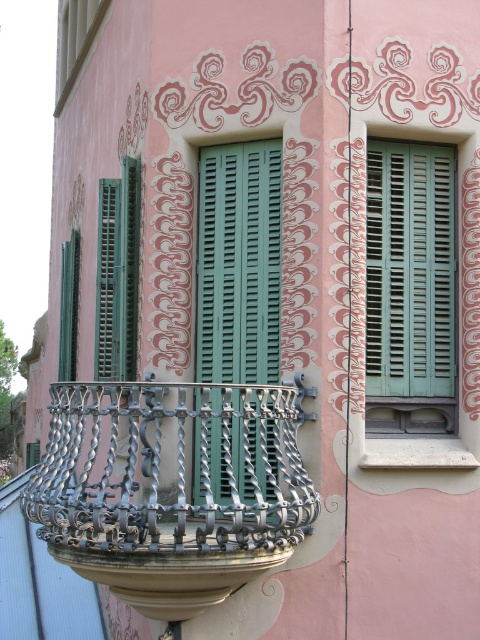
Between point (225, 280) and point (375, 362), which one is positioned behind?

The point (225, 280) is behind.

What do you see at coordinates (239, 262) in the screenshot? I see `green matte shutters at center` at bounding box center [239, 262].

Describe the element at coordinates (239, 262) in the screenshot. I see `green matte shutters at center` at that location.

Locate an element on the screen. The width and height of the screenshot is (480, 640). green matte shutters at center is located at coordinates (239, 262).

Can you confirm if polished metal balcony at center is positioned to the right of green matte shutters at center?

In fact, polished metal balcony at center is to the left of green matte shutters at center.

At what (x,y) coordinates should I click in order to perform the action: click on polished metal balcony at center. Please return your answer as a coordinate pair (x, y). Image resolution: width=480 pixels, height=640 pixels. Looking at the image, I should click on (172, 467).

Identify the location of polished metal balcony at center. This screenshot has width=480, height=640. (172, 467).

Is polished metal balcony at center taller than teal wooden shutters at center?

In fact, polished metal balcony at center may be shorter than teal wooden shutters at center.

Can you confirm if polished metal balcony at center is smaller than teal wooden shutters at center?

Incorrect, polished metal balcony at center is not smaller in size than teal wooden shutters at center.

Does point (273, 412) come behind point (409, 273)?

No, (273, 412) is in front of (409, 273).

At what (x,y) coordinates should I click in order to perform the action: click on polished metal balcony at center. Please return your answer as a coordinate pair (x, y). Looking at the image, I should click on (172, 467).